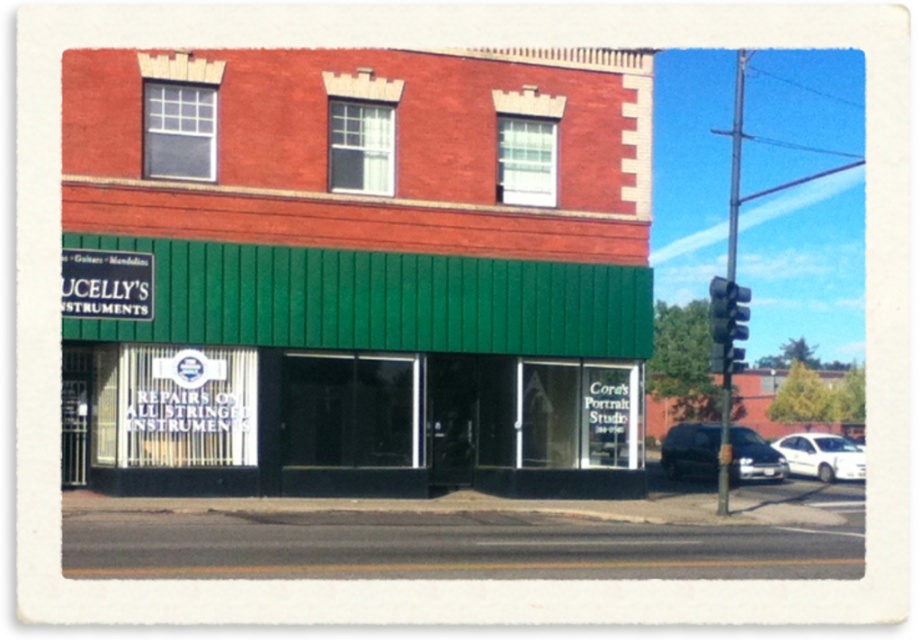
You are standing in front of the two story brick building with a green storefront. You see a point at location (x=364, y=269). What does this point represent?

The point at (x=364, y=269) represents the green woodshed at center.